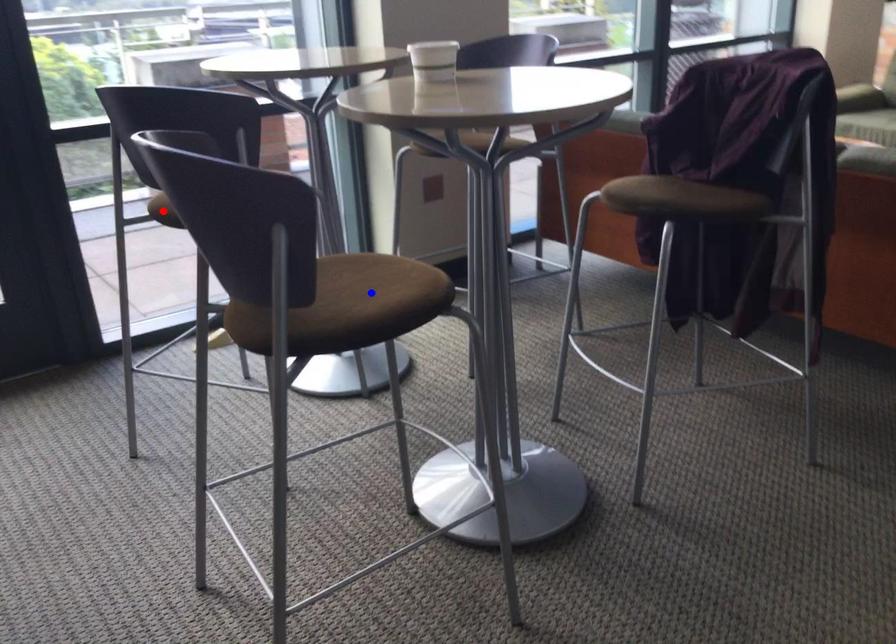
Question: Which of the two points in the image is closer to the camera?

Choices:
 (A) Blue point is closer.
 (B) Red point is closer.

Answer: (A)